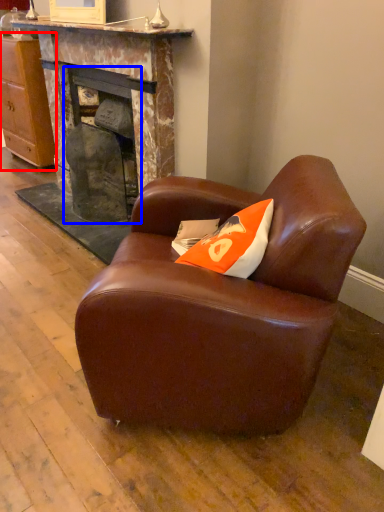
Question: Among these objects, which one is nearest to the camera, cabinetry (highlighted by a red box) or fireplace (highlighted by a blue box)?

Choices:
 (A) cabinetry
 (B) fireplace

Answer: (B)